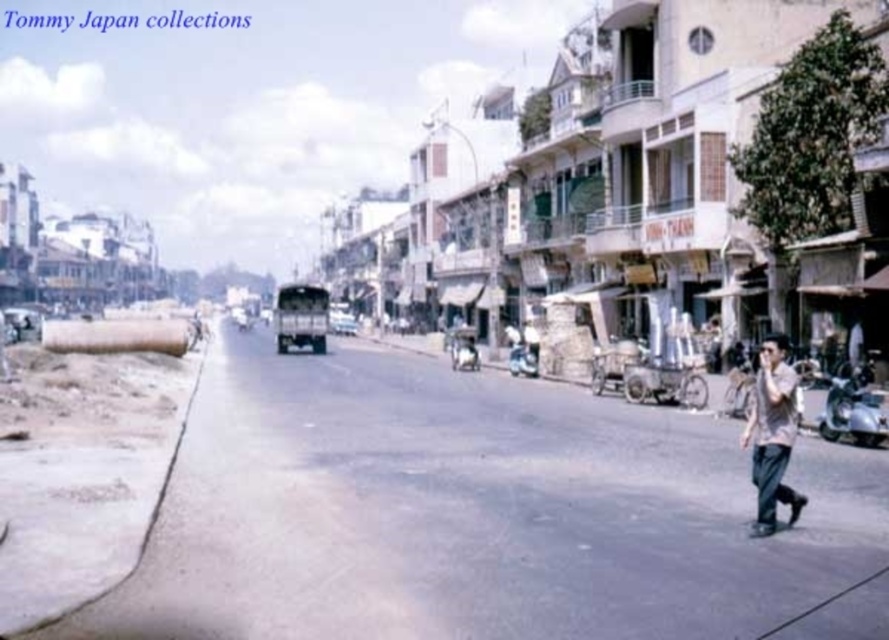
You are a delivery person standing at the point labeled point (331, 328). You need to deliver a package to the location marked by point (781, 385). Is the delivery point in front of or behind your current position?

The delivery point marked by point (781, 385) is in front of your current position at point (331, 328) because the description states that point (781, 385) is in front of point (331, 328).

You are a pedestrian standing on the street and see the light brown cotton shirt at lower right and the metallic silver bus at center. Which object is taller?

The light brown cotton shirt at lower right is much taller than the metallic silver bus at center.